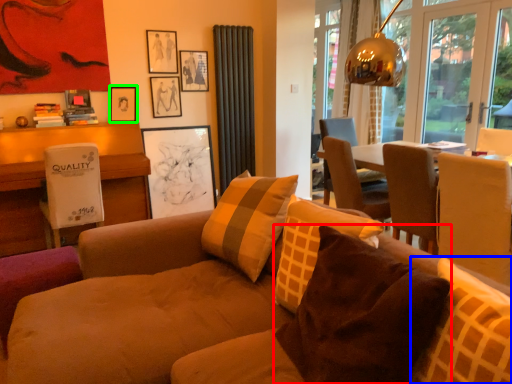
Question: Which object is the closest to the pillow (highlighted by a red box)? Choose among these: pillow (highlighted by a blue box) or picture frame (highlighted by a green box).

Choices:
 (A) pillow
 (B) picture frame

Answer: (A)